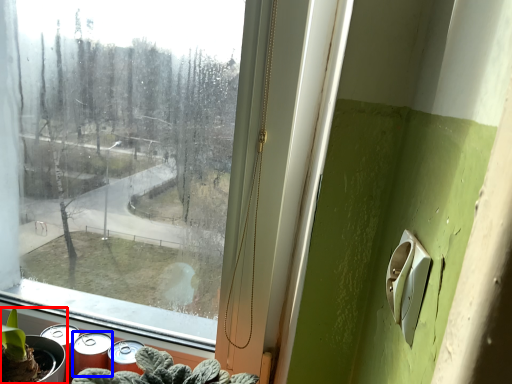
Question: Which object is further to the camera taking this photo, houseplant (highlighted by a red box) or spray (highlighted by a blue box)?

Choices:
 (A) houseplant
 (B) spray

Answer: (B)